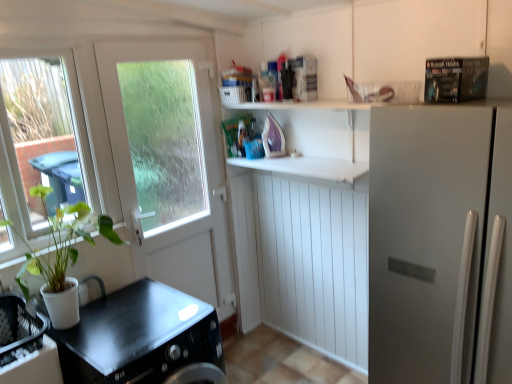
At what (x,y) coordinates should I click in order to perform the action: click on vacant space underneath white matte counter top at center, acting as the first counter top starting from the top (from a real-world perspective). Please return your answer as a coordinate pair (x, y). The height and width of the screenshot is (384, 512). Looking at the image, I should click on (308, 357).